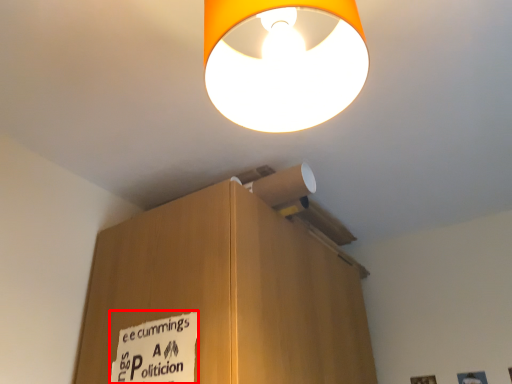
Question: Considering the relative positions of warning sign (annotated by the red box) and lamp in the image provided, where is warning sign (annotated by the red box) located with respect to the staircase?

Choices:
 (A) right
 (B) left

Answer: (B)